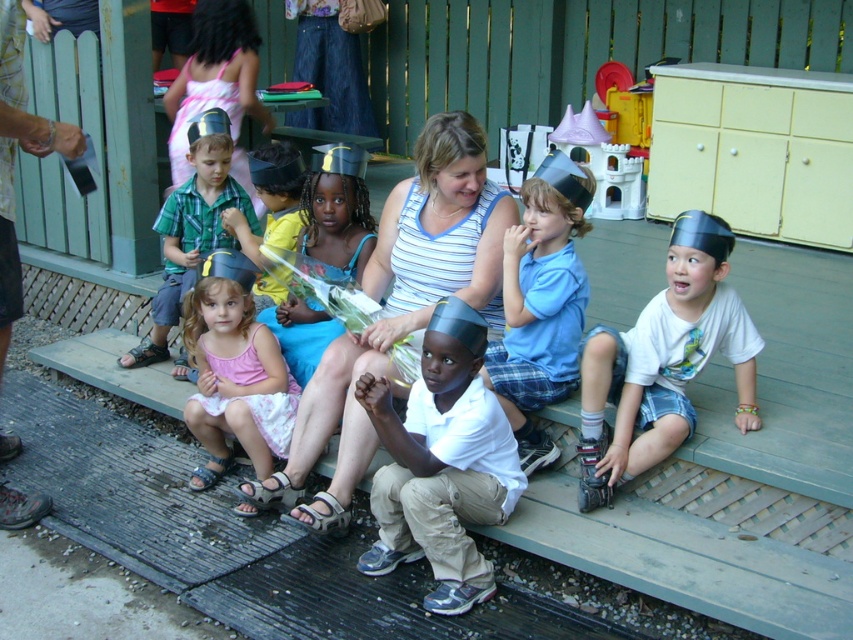
Which is more to the right, white cotton shirt at lower right or pink fabric dress at center?

Positioned to the right is white cotton shirt at lower right.

Is white cotton shirt at lower right closer to the viewer compared to pink fabric dress at center?

Yes, it is in front of pink fabric dress at center.

Which is behind, point (718, 308) or point (132, 355)?

The point (132, 355) is behind.

Locate an element on the screen. This screenshot has width=853, height=640. white cotton shirt at lower right is located at coordinates (663, 362).

Between point (660, 435) and point (299, 192), which one is positioned behind?

The point (299, 192) is behind.

Which is in front, point (704, 250) or point (252, 154)?

Point (704, 250) is more forward.

Locate an element on the screen. This screenshot has width=853, height=640. white cotton shirt at lower right is located at coordinates coord(663,362).

Based on the photo, can you confirm if white matte shirt at center is thinner than white cotton shirt at lower right?

Yes.

Can you confirm if white matte shirt at center is positioned above white cotton shirt at lower right?

No.

The image size is (853, 640). I want to click on white matte shirt at center, so click(440, 464).

Find the location of a particular element. white matte shirt at center is located at coordinates (440, 464).